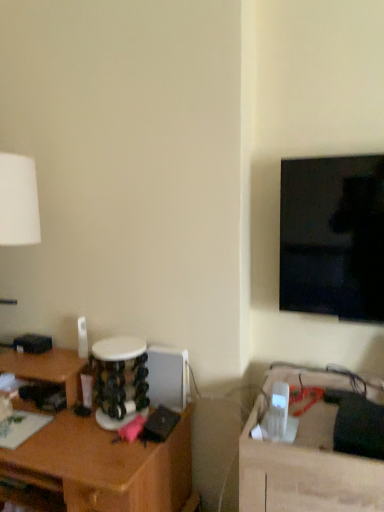
Question: Could you tell me if black glossy tv at upper right is facing brown wood desk at left?

Choices:
 (A) yes
 (B) no

Answer: (B)

Question: Can you confirm if black glossy tv at upper right is bigger than brown wood desk at left?

Choices:
 (A) yes
 (B) no

Answer: (B)

Question: Does black glossy tv at upper right have a lesser width compared to brown wood desk at left?

Choices:
 (A) yes
 (B) no

Answer: (A)

Question: Considering the relative positions of black glossy tv at upper right and brown wood desk at left in the image provided, is black glossy tv at upper right behind brown wood desk at left?

Choices:
 (A) yes
 (B) no

Answer: (A)

Question: Can you confirm if black glossy tv at upper right is wider than brown wood desk at left?

Choices:
 (A) yes
 (B) no

Answer: (B)

Question: In terms of width, does black glossy tv at upper right look wider or thinner when compared to brown wood desk at left?

Choices:
 (A) thin
 (B) wide

Answer: (A)

Question: Does point (x=379, y=215) appear closer or farther from the camera than point (x=4, y=472)?

Choices:
 (A) closer
 (B) farther

Answer: (A)

Question: From the image's perspective, relative to brown wood desk at left, is black glossy tv at upper right above or below?

Choices:
 (A) below
 (B) above

Answer: (B)

Question: In terms of size, does black glossy tv at upper right appear bigger or smaller than brown wood desk at left?

Choices:
 (A) big
 (B) small

Answer: (B)

Question: Considering the relative positions of black glossy tv at upper right and wooden table at lower right in the image provided, is black glossy tv at upper right to the left or to the right of wooden table at lower right?

Choices:
 (A) left
 (B) right

Answer: (B)

Question: Is black glossy tv at upper right wider or thinner than wooden table at lower right?

Choices:
 (A) wide
 (B) thin

Answer: (B)

Question: Which is correct: black glossy tv at upper right is inside wooden table at lower right, or outside of it?

Choices:
 (A) outside
 (B) inside

Answer: (A)

Question: From their relative heights in the image, would you say black glossy tv at upper right is taller or shorter than wooden table at lower right?

Choices:
 (A) tall
 (B) short

Answer: (B)

Question: Is wooden table at lower right taller or shorter than black glossy tv at upper right?

Choices:
 (A) tall
 (B) short

Answer: (A)

Question: From a real-world perspective, is wooden table at lower right positioned above or below black glossy tv at upper right?

Choices:
 (A) above
 (B) below

Answer: (B)